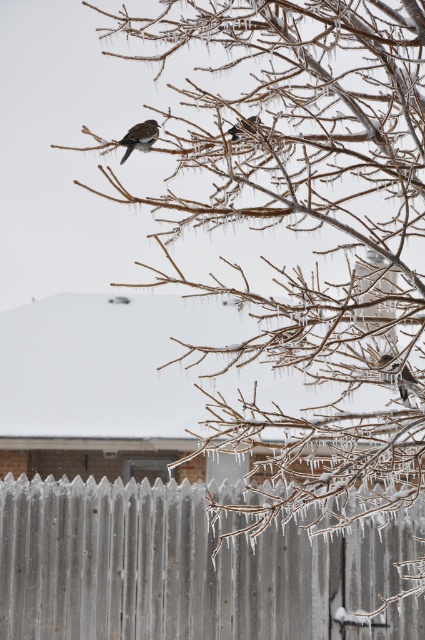
Question: Which object appears closest to the camera in this image?

Choices:
 (A) brown speckled feathers at upper center
 (B) brown speckled feathers at upper left
 (C) brown speckled feathers at upper right

Answer: (A)

Question: Can you confirm if brown speckled feathers at upper left is positioned to the right of brown speckled feathers at upper center?

Choices:
 (A) yes
 (B) no

Answer: (B)

Question: Does gray corrugated fence at lower center have a greater width compared to brown speckled feathers at upper left?

Choices:
 (A) yes
 (B) no

Answer: (A)

Question: Can you confirm if brown speckled feathers at upper left is positioned above brown speckled feathers at upper center?

Choices:
 (A) no
 (B) yes

Answer: (B)

Question: Estimate the real-world distances between objects in this image. Which object is closer to the brown speckled feathers at upper left?

Choices:
 (A) brown speckled feathers at upper right
 (B) brown speckled feathers at upper center

Answer: (B)

Question: Which of the following is the closest to the observer?

Choices:
 (A) gray corrugated fence at lower center
 (B) brown speckled feathers at upper right
 (C) brown speckled feathers at upper center

Answer: (C)